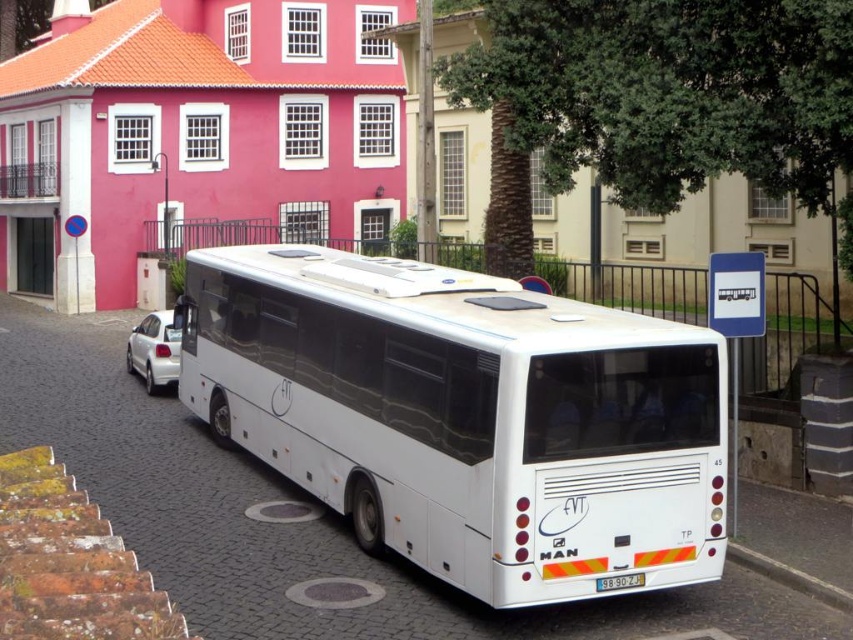
Can you confirm if white glossy car at lower left is shorter than gray concrete curb at lower right?

In fact, white glossy car at lower left may be taller than gray concrete curb at lower right.

Is white glossy car at lower left below gray concrete curb at lower right?

No.

Locate an element on the screen. The image size is (853, 640). white glossy car at lower left is located at coordinates (154, 349).

Where is `white glossy car at lower left`? The image size is (853, 640). white glossy car at lower left is located at coordinates (154, 349).

Identify the location of white matte bus at center. [466, 417].

Does point (618, 529) come in front of point (746, 548)?

Yes, point (618, 529) is in front of point (746, 548).

At what (x,y) coordinates should I click in order to perform the action: click on white matte bus at center. Please return your answer as a coordinate pair (x, y). Looking at the image, I should click on (466, 417).

Between white glossy car at lower left and white plastic license plate at rear, which one is positioned lower?

white plastic license plate at rear

Between point (149, 320) and point (619, 582), which one is positioned behind?

The point (149, 320) is more distant.

Locate an element on the screen. The width and height of the screenshot is (853, 640). white glossy car at lower left is located at coordinates (154, 349).